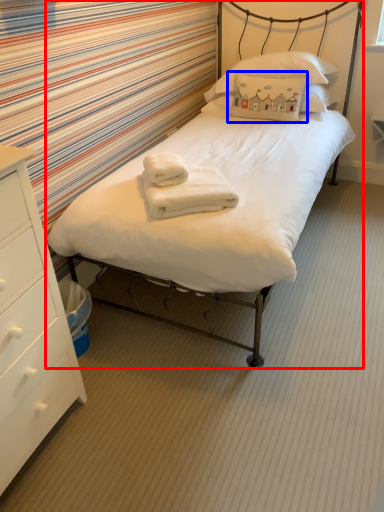
Question: Which object appears farthest to the camera in this image, bed (highlighted by a red box) or pillow (highlighted by a blue box)?

Choices:
 (A) bed
 (B) pillow

Answer: (B)